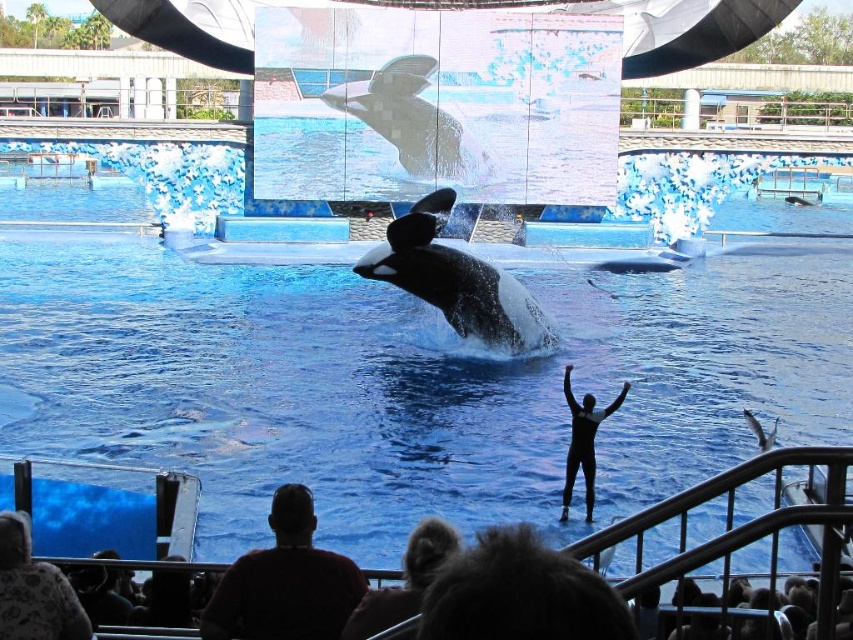
You are a guest at the marine show and want to take a photo of the black wetsuit at center. To avoid blocking the view, you need to move to the side opposite of the fluffy white sweater at lower left. Which direction should you move?

You should move to the right side because the fluffy white sweater at lower left is to the left of the black wetsuit at center, so moving to the right would give you an unobstructed view.

You are an event organizer planning to place a large promotional banner between the fluffy white sweater at lower left and the black wetsuit at center. Considering their sizes, which object should the banner be closer to to ensure it doesn

The fluffy white sweater at lower left occupies less space than the black wetsuit at center, so the banner should be closer to the black wetsuit at center to account for its larger size.